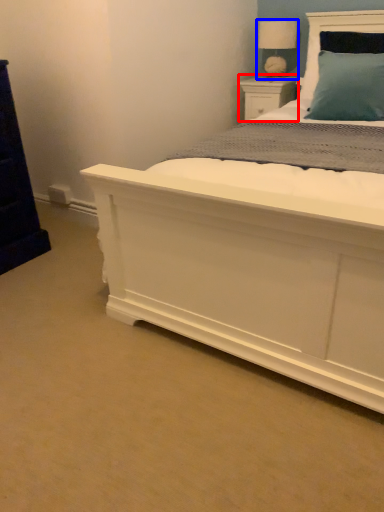
Question: Which object is further to the camera taking this photo, nightstand (highlighted by a red box) or table lamp (highlighted by a blue box)?

Choices:
 (A) nightstand
 (B) table lamp

Answer: (A)